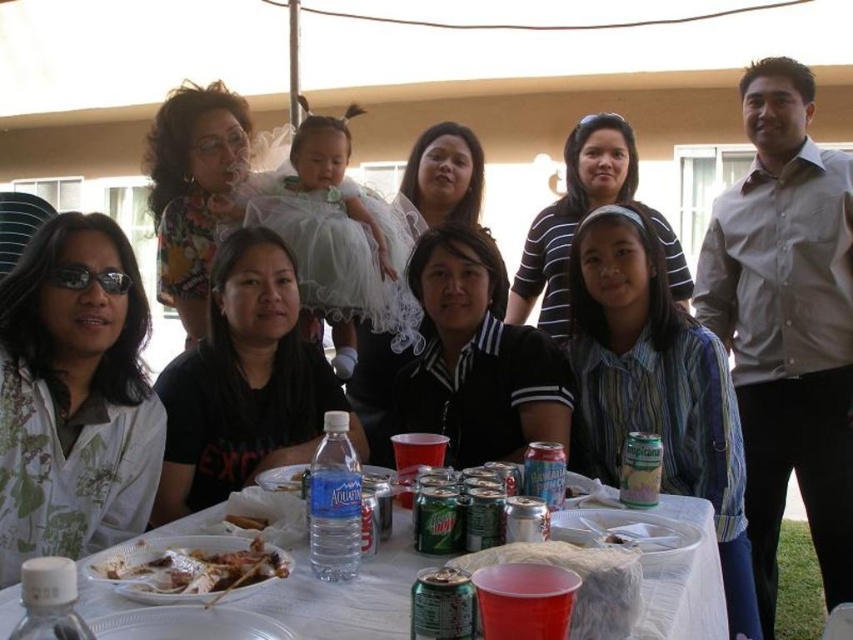
Question: Does white plastic table at center appear on the left side of grilled meat skewers at table center?

Choices:
 (A) yes
 (B) no

Answer: (B)

Question: Which of the following is the farthest from the observer?

Choices:
 (A) white crumbly bread at table center
 (B) white plastic table at center

Answer: (A)

Question: Does white plastic table at center appear on the left side of grilled meat skewers at table center?

Choices:
 (A) no
 (B) yes

Answer: (A)

Question: Is the position of white plastic table at center more distant than that of grilled meat skewers at table center?

Choices:
 (A) no
 (B) yes

Answer: (A)

Question: Considering the real-world distances, which object is farthest from the grilled meat skewers at table center?

Choices:
 (A) white crumbly bread at table center
 (B) white plastic table at center

Answer: (A)

Question: Which object is the closest to the white crumbly bread at table center?

Choices:
 (A) white plastic table at center
 (B) grilled meat skewers at table center

Answer: (B)